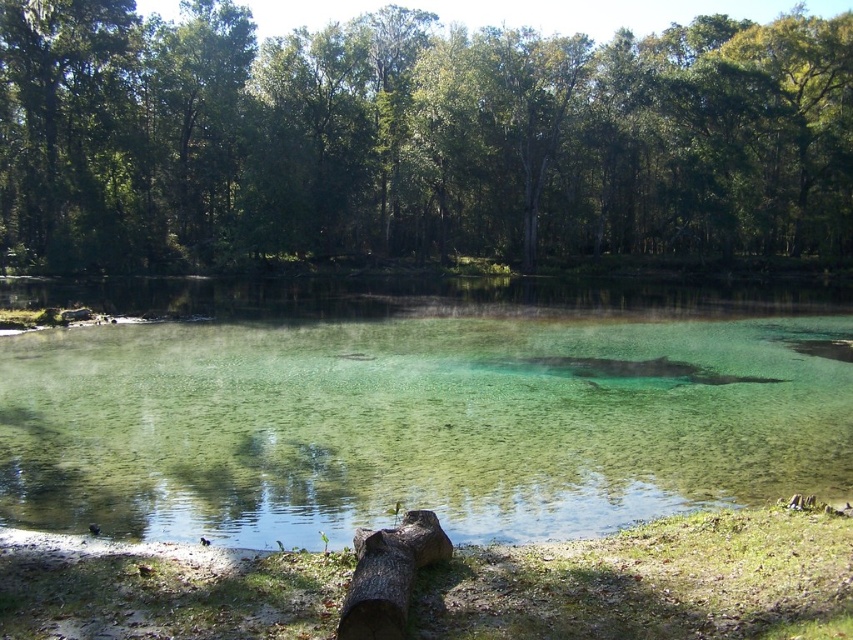
Does green leafy tree at center appear on the right side of brown rough tree trunk at lower center?

Yes, green leafy tree at center is to the right of brown rough tree trunk at lower center.

Can you confirm if green leafy tree at center is wider than brown rough tree trunk at lower center?

Yes, green leafy tree at center is wider than brown rough tree trunk at lower center.

Which is behind, point (170, 227) or point (364, 545)?

The point (170, 227) is behind.

You are a GUI agent. You are given a task and a screenshot of the screen. Output one action in this format:
    pyautogui.click(x=<x>, y=<y>)
    Task: Click on the green leafy tree at center
    
    Given the screenshot: What is the action you would take?
    pyautogui.click(x=413, y=138)

Between green leafy tree at center and clear water at center, which one has less height?

clear water at center is shorter.

Does point (16, 173) come in front of point (465, 513)?

No, it is behind (465, 513).

Between point (38, 257) and point (805, 387), which one is positioned in front?

Point (805, 387) is in front.

The width and height of the screenshot is (853, 640). In order to click on green leafy tree at center in this screenshot , I will do `click(413, 138)`.

Which is below, clear water at center or brown rough tree trunk at lower center?

brown rough tree trunk at lower center

The image size is (853, 640). Describe the element at coordinates (416, 406) in the screenshot. I see `clear water at center` at that location.

I want to click on clear water at center, so click(416, 406).